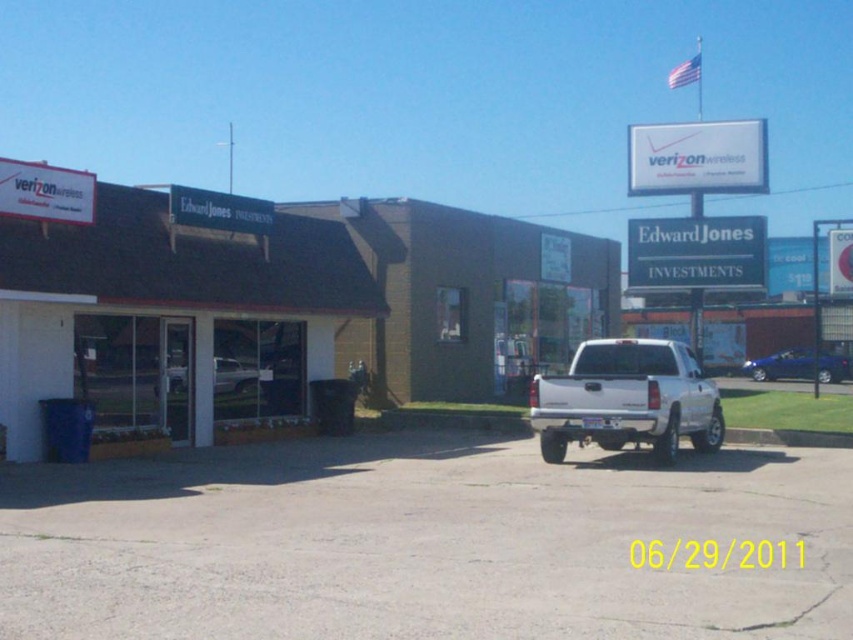
Question: Which point is closer to the camera?

Choices:
 (A) white brick storefront at left
 (B) white matte truck at center
 (C) silver metallic pickup truck at center
 (D) metallic blue sedan at right

Answer: (A)

Question: In this image, where is silver metallic pickup truck at center located relative to white matte truck at center?

Choices:
 (A) left
 (B) right

Answer: (B)

Question: Which object appears closest to the camera in this image?

Choices:
 (A) white brick storefront at left
 (B) silver metallic pickup truck at center
 (C) white matte truck at center
 (D) metallic blue sedan at right

Answer: (A)

Question: Is white brick storefront at left further to the viewer compared to white matte truck at center?

Choices:
 (A) yes
 (B) no

Answer: (B)

Question: Is white brick storefront at left thinner than silver metallic pickup truck at center?

Choices:
 (A) yes
 (B) no

Answer: (B)

Question: Which point is farther to the camera?

Choices:
 (A) silver metallic pickup truck at center
 (B) white matte truck at center

Answer: (B)